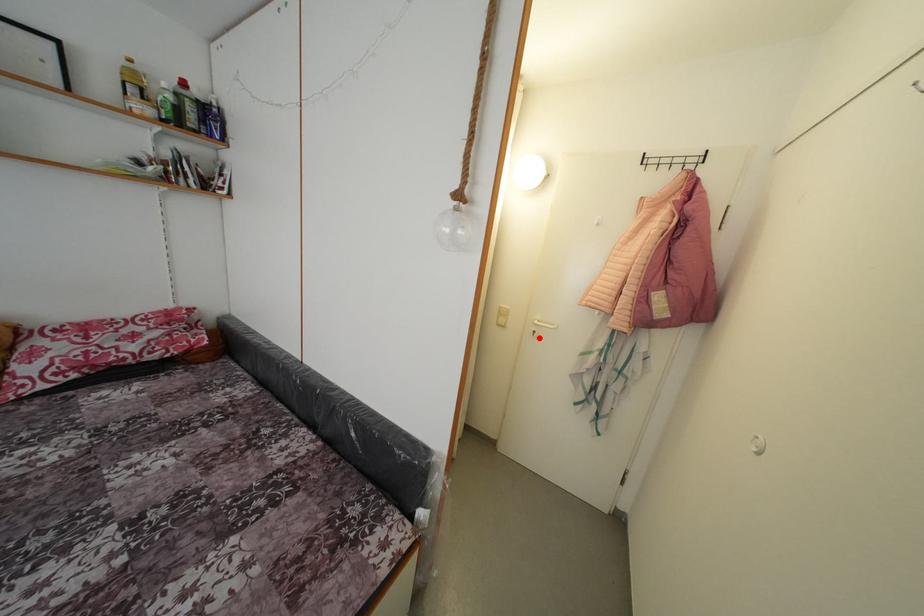
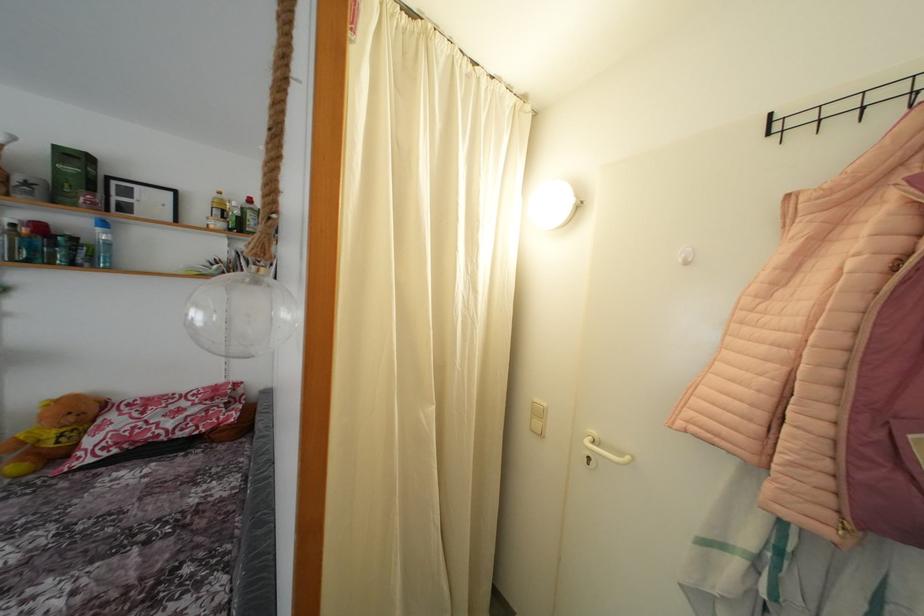
The point at the highlighted location is marked in the first image. Where is the corresponding point in the second image?

(593, 464)